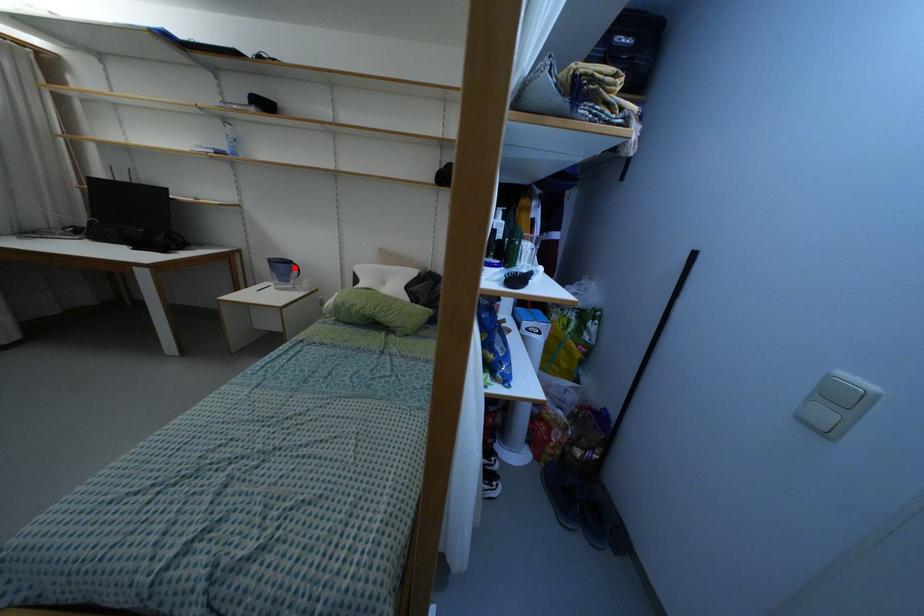
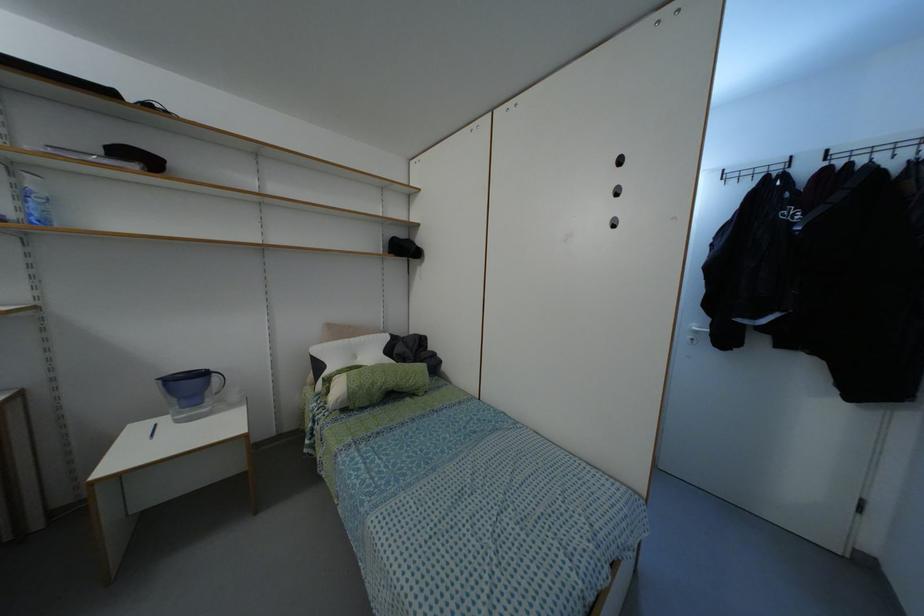
Question: I am providing you with two images of the same scene from different viewpoints. Image1 has a red point marked. In image2, the corresponding 3D location appears at what relative position? Reply with the corresponding letter.

Choices:
 (A) Closer
 (B) Farther

Answer: (B)